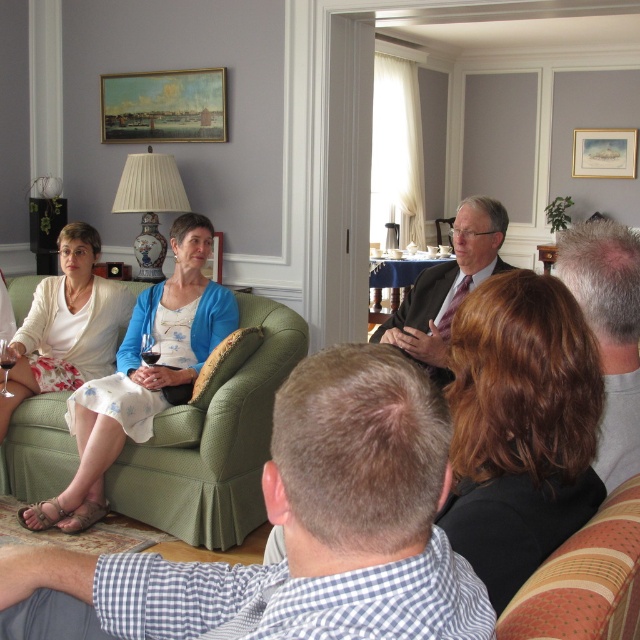
You are at a party and want to sit down. You see the matte white dress at center and the matte green couch at center. Which object is closer to you?

The matte white dress at center is closer to you because the matte green couch at center is behind it.

What are the coordinates of the brown hair at center?

The brown hair at center is located at point (520, 428).